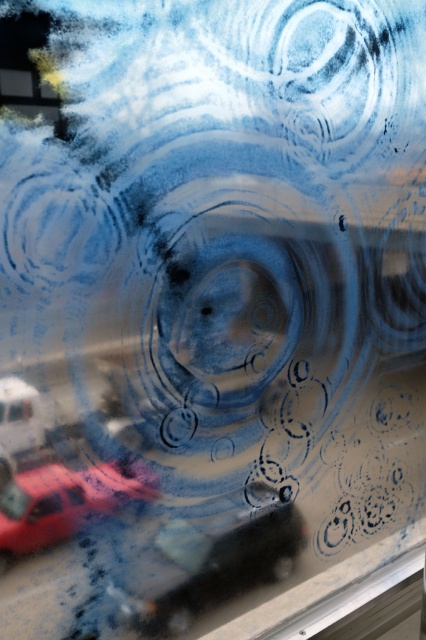
Question: Is shiny black car at center below shiny red car at lower left?

Choices:
 (A) no
 (B) yes

Answer: (B)

Question: Can you confirm if shiny black car at center is positioned to the left of shiny red car at lower left?

Choices:
 (A) yes
 (B) no

Answer: (B)

Question: Does shiny black car at center have a larger size compared to shiny red car at lower left?

Choices:
 (A) no
 (B) yes

Answer: (B)

Question: Among these points, which one is nearest to the camera?

Choices:
 (A) (46, 536)
 (B) (121, 605)

Answer: (A)